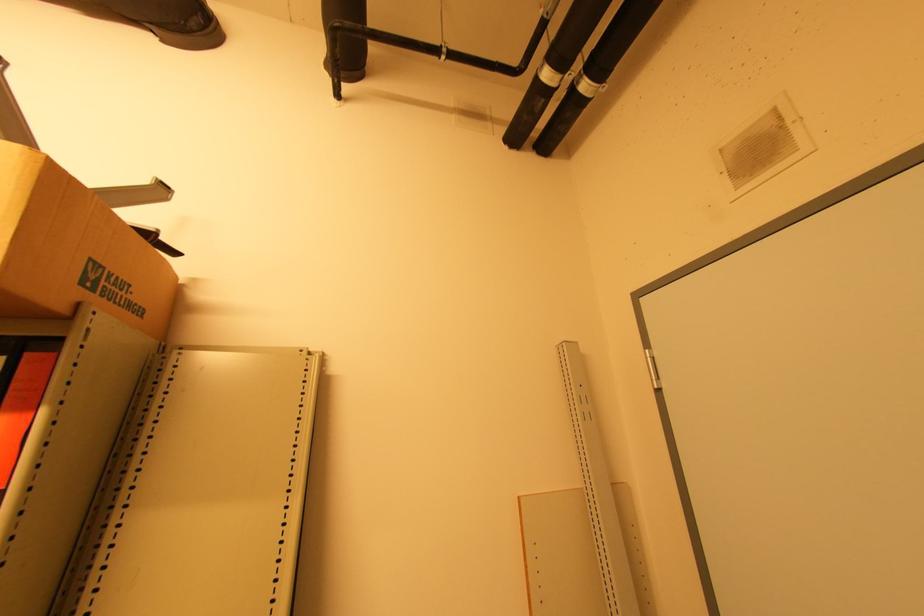
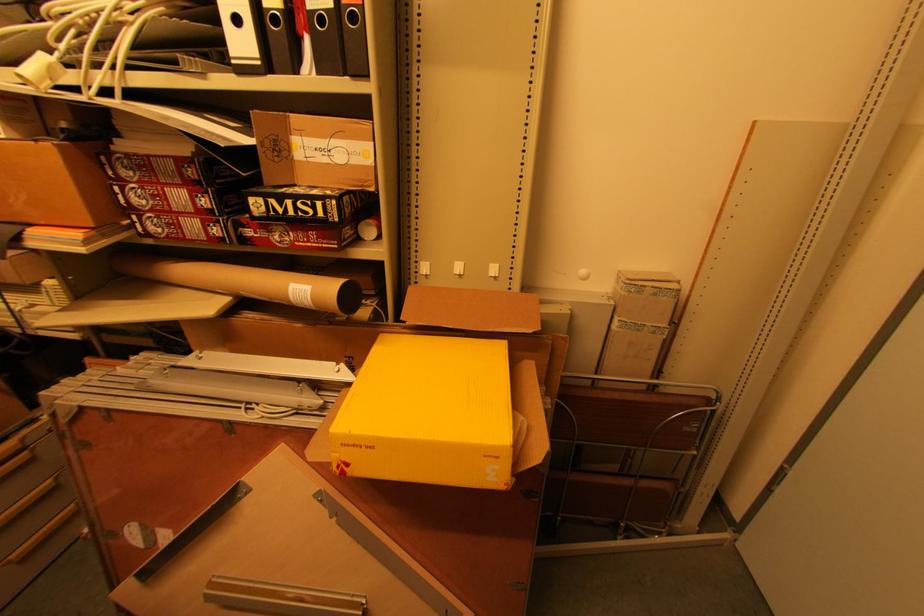
The first image is from the beginning of the video and the second image is from the end. How did the camera likely rotate when shooting the video?

The camera rotated toward left-down.